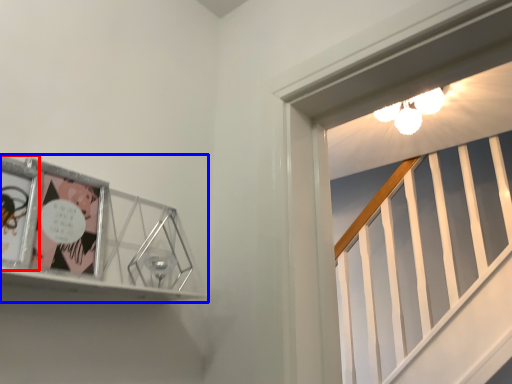
Question: Which object appears closest to the camera in this image, comic book (highlighted by a red box) or picture frame (highlighted by a blue box)?

Choices:
 (A) comic book
 (B) picture frame

Answer: (B)